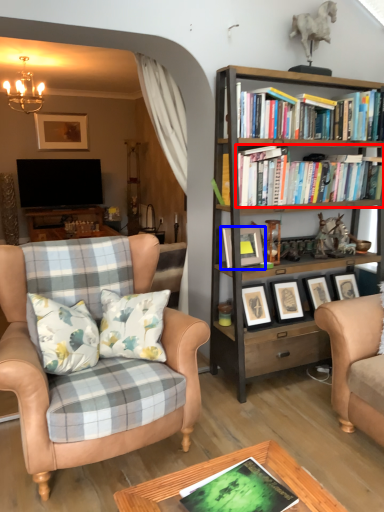
Question: Which of the following is the farthest to the observer, book (highlighted by a red box) or picture frame (highlighted by a blue box)?

Choices:
 (A) book
 (B) picture frame

Answer: (A)